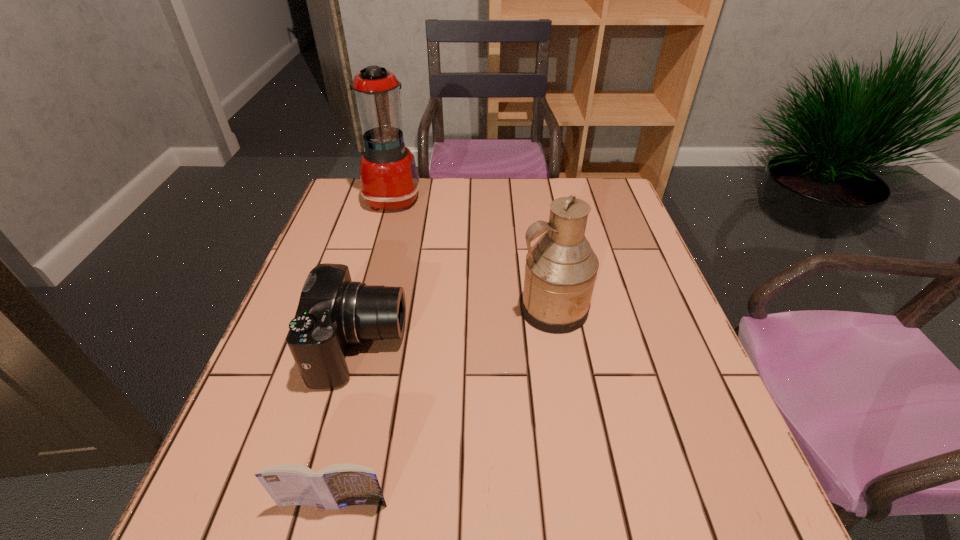
Where is `free spot at the right edge of the desktop`? free spot at the right edge of the desktop is located at coordinates (702, 376).

You are a GUI agent. You are given a task and a screenshot of the screen. Output one action in this format:
    pyautogui.click(x=<x>, y=<y>)
    Task: Click on the vacant region at the far left corner
    The width and height of the screenshot is (960, 540).
    Given the screenshot: What is the action you would take?
    coord(364,211)

Locate an element on the screen. The image size is (960, 540). blank space at the far right corner of the desktop is located at coordinates (594, 200).

Where is `empty space that is in between the second shortest object and the food processor`? empty space that is in between the second shortest object and the food processor is located at coordinates (377, 272).

Find the location of a particular element. The width and height of the screenshot is (960, 540). free area in between the book and the second shortest object is located at coordinates (348, 424).

What are the coordinates of `blank region between the camera and the pitcher` in the screenshot? It's located at (457, 328).

Locate an element on the screen. This screenshot has width=960, height=540. empty space that is in between the camera and the pitcher is located at coordinates (457, 328).

Locate an element on the screen. free spot between the second tallest object and the food processor is located at coordinates (473, 253).

Identify the location of free spot between the farthest object and the pitcher. Image resolution: width=960 pixels, height=540 pixels. (473, 253).

Identify the location of free space between the rightmost object and the farthest object. This screenshot has width=960, height=540. (473, 253).